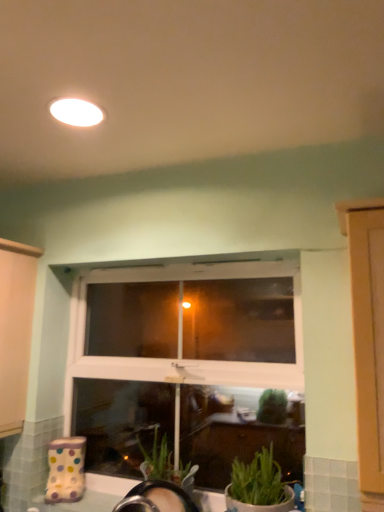
Question: Is white plastic window at center taller or shorter than green matte plant at lower right?

Choices:
 (A) short
 (B) tall

Answer: (B)

Question: In the image, is white plastic window at center positioned in front of or behind green matte plant at lower right?

Choices:
 (A) front
 (B) behind

Answer: (B)

Question: Based on their relative distances, which object is farther from the white plastic window at center?

Choices:
 (A) green matte plant at lower right
 (B) white matte light fixture at upper center

Answer: (B)

Question: Estimate the real-world distances between objects in this image. Which object is farther from the white matte light fixture at upper center?

Choices:
 (A) green matte plant at lower right
 (B) white plastic window at center

Answer: (A)